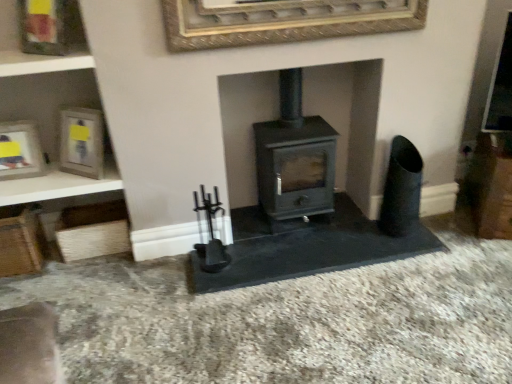
Image resolution: width=512 pixels, height=384 pixels. I want to click on matte gray wood burning stove at center, so click(294, 161).

The image size is (512, 384). Identify the location of gold textured picture frame at upper center, acting as the first picture frame starting from the right. (284, 21).

Image resolution: width=512 pixels, height=384 pixels. Find the location of `matte silver picture frame at upper left, the second picture frame from the right`. matte silver picture frame at upper left, the second picture frame from the right is located at coordinates (81, 142).

The image size is (512, 384). Identify the location of matte gray wood burning stove at center. (294, 161).

Which object is closer to the camera, wooden frame at upper left, the third picture frame when ordered from right to left, or matte silver picture frame at left, arranged as the 1th picture frame when viewed from the left?

wooden frame at upper left, the third picture frame when ordered from right to left, is in front.

Which of these two, wooden frame at upper left, the 2th picture frame from the left, or matte silver picture frame at left, arranged as the 1th picture frame when viewed from the left, stands shorter?

wooden frame at upper left, the 2th picture frame from the left.

Considering the relative positions of wooden frame at upper left, the 2th picture frame from the left, and matte silver picture frame at left, placed as the fourth picture frame when sorted from right to left, in the image provided, is wooden frame at upper left, the 2th picture frame from the left, to the left or to the right of matte silver picture frame at left, placed as the fourth picture frame when sorted from right to left,?

wooden frame at upper left, the 2th picture frame from the left, is to the right of matte silver picture frame at left, placed as the fourth picture frame when sorted from right to left.

Considering the relative sizes of wooden frame at upper left, the 2th picture frame from the left, and matte silver picture frame at left, arranged as the 1th picture frame when viewed from the left, in the image provided, is wooden frame at upper left, the 2th picture frame from the left, wider than matte silver picture frame at left, arranged as the 1th picture frame when viewed from the left,?

In fact, wooden frame at upper left, the 2th picture frame from the left, might be narrower than matte silver picture frame at left, arranged as the 1th picture frame when viewed from the left.

From the image's perspective, is gold textured picture frame at upper center, the fourth picture frame from the left, on top of matte silver picture frame at upper left, which appears as the third picture frame when viewed from the left?

Yes, from the image's perspective, gold textured picture frame at upper center, the fourth picture frame from the left, is over matte silver picture frame at upper left, which appears as the third picture frame when viewed from the left.

Which picture frame is the 2nd one when counting from the front of the matte silver picture frame at upper left, the second picture frame from the right? Please provide its 2D coordinates.

[(284, 21)]

Does gold textured picture frame at upper center, the fourth picture frame from the left, have a greater height compared to matte silver picture frame at upper left, the second picture frame from the right?

Incorrect, the height of gold textured picture frame at upper center, the fourth picture frame from the left, is not larger of that of matte silver picture frame at upper left, the second picture frame from the right.

Measure the distance from gold textured picture frame at upper center, acting as the first picture frame starting from the right, to matte silver picture frame at upper left, which appears as the third picture frame when viewed from the left.

They are 32.70 inches apart.

From the image's perspective, which one is positioned higher, matte silver picture frame at left, arranged as the 1th picture frame when viewed from the left, or wooden shelf at upper left?

wooden shelf at upper left is shown above in the image.

Does matte silver picture frame at left, arranged as the 1th picture frame when viewed from the left, turn towards wooden shelf at upper left?

No, matte silver picture frame at left, arranged as the 1th picture frame when viewed from the left, is not turned towards wooden shelf at upper left.

How different are the orientations of matte silver picture frame at left, arranged as the 1th picture frame when viewed from the left, and wooden shelf at upper left in degrees?

matte silver picture frame at left, arranged as the 1th picture frame when viewed from the left, and wooden shelf at upper left are facing 2.29 degrees away from each other.

Considering the positions of objects matte silver picture frame at left, arranged as the 1th picture frame when viewed from the left, and wooden shelf at upper left in the image provided, who is more to the right, matte silver picture frame at left, arranged as the 1th picture frame when viewed from the left, or wooden shelf at upper left?

wooden shelf at upper left.

Looking at this image, in the image, is matte silver picture frame at left, placed as the fourth picture frame when sorted from right to left, positioned in front of or behind wooden frame at upper left, the 2th picture frame from the left?

Visually, matte silver picture frame at left, placed as the fourth picture frame when sorted from right to left, is located behind wooden frame at upper left, the 2th picture frame from the left.

Between point (8, 149) and point (55, 21), which one is positioned behind?

Point (8, 149)

In terms of size, does matte silver picture frame at left, arranged as the 1th picture frame when viewed from the left, appear bigger or smaller than wooden frame at upper left, the 2th picture frame from the left?

matte silver picture frame at left, arranged as the 1th picture frame when viewed from the left, is bigger than wooden frame at upper left, the 2th picture frame from the left.

Where is `picture frame that is the 2nd one when counting downward from the wooden frame at upper left, the third picture frame when ordered from right to left (from the image's perspective)`? picture frame that is the 2nd one when counting downward from the wooden frame at upper left, the third picture frame when ordered from right to left (from the image's perspective) is located at coordinates (20, 150).

Is gold textured picture frame at upper center, the fourth picture frame from the left, bigger or smaller than wooden frame at upper left, the 2th picture frame from the left?

Clearly, gold textured picture frame at upper center, the fourth picture frame from the left, is larger in size than wooden frame at upper left, the 2th picture frame from the left.

Does point (172, 46) appear closer or farther from the camera than point (62, 0)?

Point (172, 46) appears to be farther away from the viewer than point (62, 0).

Is gold textured picture frame at upper center, acting as the first picture frame starting from the right, far away from wooden frame at upper left, the third picture frame when ordered from right to left?

gold textured picture frame at upper center, acting as the first picture frame starting from the right, is actually quite close to wooden frame at upper left, the third picture frame when ordered from right to left.

Is wooden shelf at upper left looking in the opposite direction of gold textured picture frame at upper center, acting as the first picture frame starting from the right?

No, wooden shelf at upper left is not facing away from gold textured picture frame at upper center, acting as the first picture frame starting from the right.

Considering the relative positions of wooden shelf at upper left and gold textured picture frame at upper center, acting as the first picture frame starting from the right, in the image provided, is wooden shelf at upper left to the left or to the right of gold textured picture frame at upper center, acting as the first picture frame starting from the right,?

In the image, wooden shelf at upper left appears on the left side of gold textured picture frame at upper center, acting as the first picture frame starting from the right.

From the image's perspective, between wooden shelf at upper left and gold textured picture frame at upper center, acting as the first picture frame starting from the right, who is located below?

wooden shelf at upper left, from the image's perspective.

Is point (52, 65) less distant than point (222, 10)?

That is False.

Can you confirm if gold textured picture frame at upper center, the fourth picture frame from the left, is positioned to the right of matte silver picture frame at left, placed as the fourth picture frame when sorted from right to left?

Indeed, gold textured picture frame at upper center, the fourth picture frame from the left, is positioned on the right side of matte silver picture frame at left, placed as the fourth picture frame when sorted from right to left.

From the image's perspective, is gold textured picture frame at upper center, acting as the first picture frame starting from the right, beneath matte silver picture frame at left, placed as the fourth picture frame when sorted from right to left?

Incorrect, from the image's perspective, gold textured picture frame at upper center, acting as the first picture frame starting from the right, is higher than matte silver picture frame at left, placed as the fourth picture frame when sorted from right to left.

Does gold textured picture frame at upper center, acting as the first picture frame starting from the right, turn towards matte silver picture frame at left, arranged as the 1th picture frame when viewed from the left?

No.

Find the location of `the 2nd picture frame behind the wooden frame at upper left, the third picture frame when ordered from right to left`. the 2nd picture frame behind the wooden frame at upper left, the third picture frame when ordered from right to left is located at coordinates (20, 150).

Starting from the gold textured picture frame at upper center, the fourth picture frame from the left, which picture frame is the 1st one to the left? Please provide its 2D coordinates.

[(81, 142)]

Which object lies nearer to the anchor point gold textured picture frame at upper center, acting as the first picture frame starting from the right, matte silver picture frame at left, arranged as the 1th picture frame when viewed from the left, or matte gray wood burning stove at center?

matte gray wood burning stove at center.

From the image, which object appears to be nearer to matte gray wood burning stove at center, matte silver picture frame at left, arranged as the 1th picture frame when viewed from the left, or gold textured picture frame at upper center, acting as the first picture frame starting from the right?

The object closer to matte gray wood burning stove at center is gold textured picture frame at upper center, acting as the first picture frame starting from the right.

Estimate the real-world distances between objects in this image. Which object is further from wooden shelf at upper left, matte silver picture frame at left, arranged as the 1th picture frame when viewed from the left, or gold textured picture frame at upper center, the fourth picture frame from the left?

Based on the image, gold textured picture frame at upper center, the fourth picture frame from the left, appears to be further to wooden shelf at upper left.

Looking at this image, when comparing their distances from wooden frame at upper left, the 2th picture frame from the left, does wooden shelf at upper left or matte silver picture frame at upper left, which appears as the third picture frame when viewed from the left, seem closer?

wooden shelf at upper left is closer to wooden frame at upper left, the 2th picture frame from the left.

Based on their spatial positions, is gold textured picture frame at upper center, acting as the first picture frame starting from the right, or matte silver picture frame at left, arranged as the 1th picture frame when viewed from the left, closer to matte silver picture frame at upper left, the second picture frame from the right?

Based on the image, matte silver picture frame at left, arranged as the 1th picture frame when viewed from the left, appears to be nearer to matte silver picture frame at upper left, the second picture frame from the right.

Which object lies nearer to the anchor point matte gray wood burning stove at center, wooden shelf at upper left or gold textured picture frame at upper center, acting as the first picture frame starting from the right?

gold textured picture frame at upper center, acting as the first picture frame starting from the right, lies closer to matte gray wood burning stove at center than the other object.

Which object lies further to the anchor point wooden shelf at upper left, matte gray wood burning stove at center or matte silver picture frame at left, placed as the fourth picture frame when sorted from right to left?

Based on the image, matte gray wood burning stove at center appears to be further to wooden shelf at upper left.

Based on their spatial positions, is gold textured picture frame at upper center, acting as the first picture frame starting from the right, or wooden shelf at upper left further from matte silver picture frame at left, arranged as the 1th picture frame when viewed from the left?

gold textured picture frame at upper center, acting as the first picture frame starting from the right, is further to matte silver picture frame at left, arranged as the 1th picture frame when viewed from the left.

Identify the location of shelf between wooden frame at upper left, the third picture frame when ordered from right to left, and matte silver picture frame at left, placed as the fourth picture frame when sorted from right to left, from top to bottom. (x=41, y=63).

Locate an element on the screen. picture frame situated between matte silver picture frame at upper left, the second picture frame from the right, and matte gray wood burning stove at center from left to right is located at coordinates (284, 21).

Find the location of a particular element. This screenshot has height=384, width=512. picture frame between wooden shelf at upper left and matte silver picture frame at left, placed as the fourth picture frame when sorted from right to left, vertically is located at coordinates (81, 142).

At what (x,y) coordinates should I click in order to perform the action: click on shelf situated between matte silver picture frame at left, placed as the fourth picture frame when sorted from right to left, and matte gray wood burning stove at center from left to right. Please return your answer as a coordinate pair (x, y). Looking at the image, I should click on (41, 63).